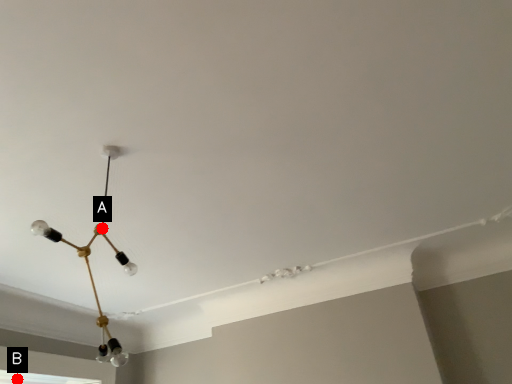
Question: Two points are circled on the image, labeled by A and B beside each circle. Which point is farther from the camera taking this photo?

Choices:
 (A) A is further
 (B) B is further

Answer: (B)